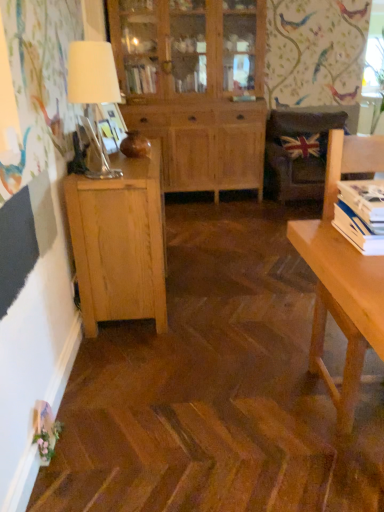
Question: Is natural wood cabinet at center, the 1th cabinetry from the back, further to the viewer compared to white paper stack at right?

Choices:
 (A) yes
 (B) no

Answer: (A)

Question: Is natural wood cabinet at center, which is counted as the second cabinetry, starting from the bottom, taller than white paper stack at right?

Choices:
 (A) yes
 (B) no

Answer: (A)

Question: From the image's perspective, does natural wood cabinet at center, the 1th cabinetry from the back, appear higher than white paper stack at right?

Choices:
 (A) no
 (B) yes

Answer: (B)

Question: From the image's perspective, does natural wood cabinet at center, the 1th cabinetry positioned from the top, appear lower than white paper stack at right?

Choices:
 (A) yes
 (B) no

Answer: (B)

Question: Can you confirm if natural wood cabinet at center, the 1th cabinetry positioned from the top, is bigger than white paper stack at right?

Choices:
 (A) yes
 (B) no

Answer: (A)

Question: Considering the positions of natural wood cabinet at center, the 1th cabinetry positioned from the top, and natural wood cabinet at left, which appears as the first cabinetry when viewed from the front, in the image, is natural wood cabinet at center, the 1th cabinetry positioned from the top, wider or thinner than natural wood cabinet at left, which appears as the first cabinetry when viewed from the front,?

Choices:
 (A) thin
 (B) wide

Answer: (B)

Question: Is natural wood cabinet at center, the 1th cabinetry from the back, in front of or behind natural wood cabinet at left, which appears as the first cabinetry when ordered from the bottom, in the image?

Choices:
 (A) behind
 (B) front

Answer: (A)

Question: Is point (183, 54) positioned closer to the camera than point (145, 295)?

Choices:
 (A) farther
 (B) closer

Answer: (A)

Question: Is natural wood cabinet at center, the 1th cabinetry positioned from the top, bigger or smaller than natural wood cabinet at left, the 2th cabinetry viewed from the top?

Choices:
 (A) big
 (B) small

Answer: (A)

Question: In the image, is union jack fabric pillow at upper right positioned in front of or behind natural wood cabinet at left, which appears as the first cabinetry when ordered from the bottom?

Choices:
 (A) front
 (B) behind

Answer: (B)

Question: Would you say union jack fabric pillow at upper right is inside or outside natural wood cabinet at left, which appears as the first cabinetry when viewed from the front?

Choices:
 (A) outside
 (B) inside

Answer: (A)

Question: In the image, is union jack fabric pillow at upper right on the left side or the right side of natural wood cabinet at left, which appears as the first cabinetry when ordered from the bottom?

Choices:
 (A) left
 (B) right

Answer: (B)

Question: From the image's perspective, is union jack fabric pillow at upper right above or below natural wood cabinet at left, which appears as the first cabinetry when viewed from the front?

Choices:
 (A) below
 (B) above

Answer: (B)

Question: From a real-world perspective, relative to natural wood cabinet at center, which is counted as the second cabinetry, starting from the front, is white paper stack at right vertically above or below?

Choices:
 (A) below
 (B) above

Answer: (A)

Question: Is white paper stack at right in front of or behind natural wood cabinet at center, which is counted as the second cabinetry, starting from the bottom, in the image?

Choices:
 (A) behind
 (B) front

Answer: (B)